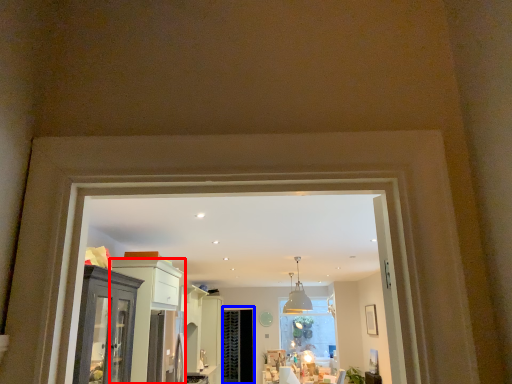
Question: Which of the following is the farthest to the observer, cabinetry (highlighted by a red box) or screen door (highlighted by a blue box)?

Choices:
 (A) cabinetry
 (B) screen door

Answer: (B)